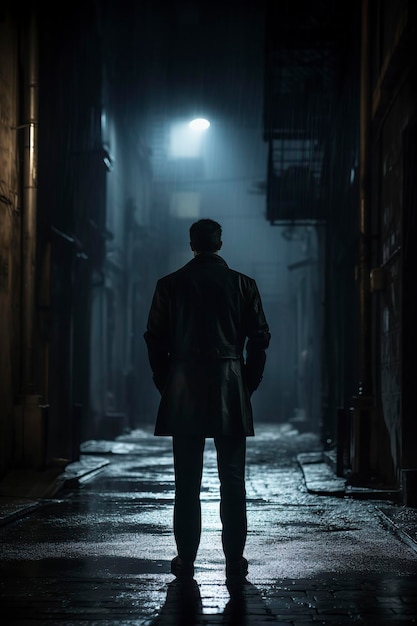
Find the location of a particular element. Image resolution: width=417 pixels, height=626 pixels. light is located at coordinates (197, 125).